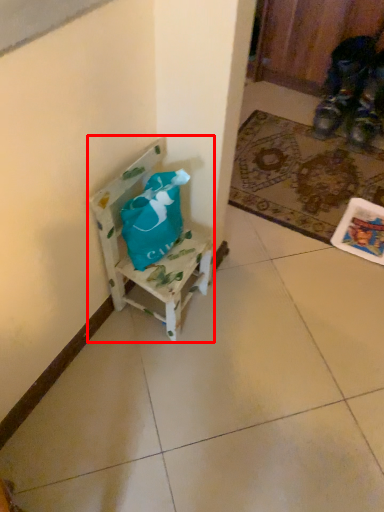
Question: In this image, where is chair (annotated by the red box) located relative to mat?

Choices:
 (A) left
 (B) right

Answer: (A)